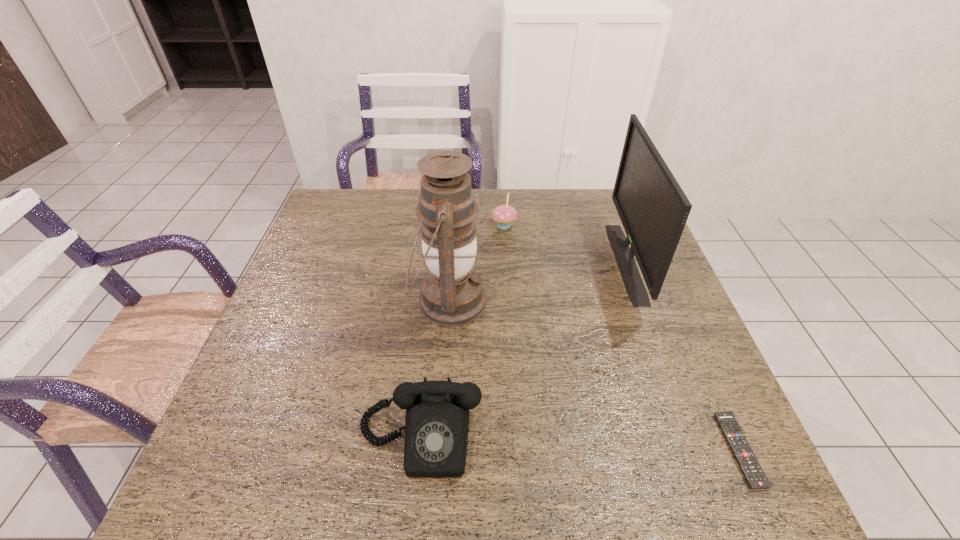
This screenshot has width=960, height=540. I want to click on free space that satisfies the following two spatial constraints: 1. on the front-facing side of the second tallest object; 2. on the left side of the shortest object, so click(x=695, y=450).

The width and height of the screenshot is (960, 540). What are the coordinates of `free location that satisfies the following two spatial constraints: 1. on the front-facing side of the fourth shortest object; 2. on the back side of the remote control` in the screenshot? It's located at (695, 450).

Image resolution: width=960 pixels, height=540 pixels. I want to click on blank space that satisfies the following two spatial constraints: 1. on the front-facing side of the rightmost object; 2. on the left side of the fourth object from left to right, so click(x=695, y=450).

I want to click on free space that satisfies the following two spatial constraints: 1. on the front-facing side of the second object from right to left; 2. on the front side of the oil lamp, so click(x=640, y=301).

Image resolution: width=960 pixels, height=540 pixels. Find the location of `free space that satisfies the following two spatial constraints: 1. on the dial of the rightmost object; 2. on the left side of the telephone`. free space that satisfies the following two spatial constraints: 1. on the dial of the rightmost object; 2. on the left side of the telephone is located at coordinates (419, 450).